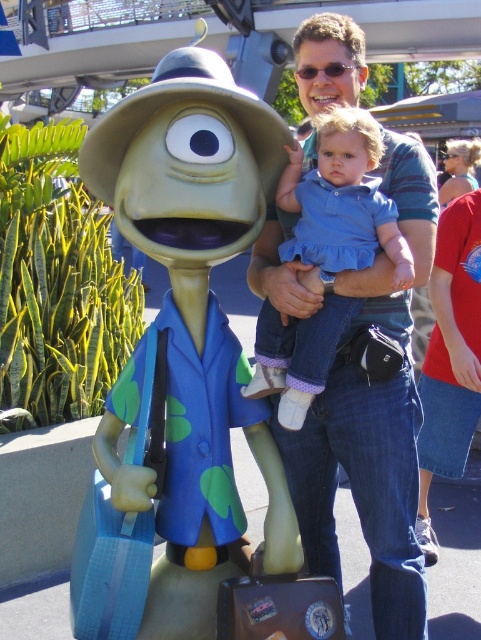
Question: Can you confirm if matte green plastic alien at center is positioned below denim dress at center?

Choices:
 (A) yes
 (B) no

Answer: (A)

Question: In this image, where is denim jeans at center located relative to denim dress at center?

Choices:
 (A) right
 (B) left

Answer: (A)

Question: Can you confirm if matte green plastic alien at center is positioned to the right of denim dress at center?

Choices:
 (A) yes
 (B) no

Answer: (B)

Question: Which object is closer to the camera taking this photo?

Choices:
 (A) denim dress at center
 (B) denim jeans at center

Answer: (A)

Question: Which of the following is the closest to the observer?

Choices:
 (A) (351, 166)
 (B) (365, 528)

Answer: (A)

Question: Which is farther from the matte green plastic alien at center?

Choices:
 (A) denim jeans at center
 (B) denim dress at center

Answer: (A)